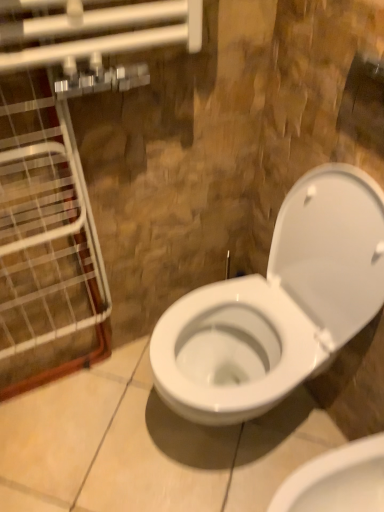
Question: From the image's perspective, is clear glass door at left under white glossy toilet at center, the first toilet ordered from the bottom?

Choices:
 (A) no
 (B) yes

Answer: (A)

Question: Can you confirm if clear glass door at left is thinner than white glossy toilet at center, the first toilet ordered from the bottom?

Choices:
 (A) no
 (B) yes

Answer: (B)

Question: Is the depth of clear glass door at left greater than that of white glossy toilet at center, acting as the second toilet starting from the top?

Choices:
 (A) no
 (B) yes

Answer: (A)

Question: Is clear glass door at left turned away from white glossy toilet at center, the first toilet ordered from the bottom?

Choices:
 (A) no
 (B) yes

Answer: (A)

Question: From the image's perspective, is clear glass door at left above white glossy toilet at center, the first toilet ordered from the bottom?

Choices:
 (A) no
 (B) yes

Answer: (B)

Question: Does clear glass door at left have a larger size compared to white glossy toilet at center, acting as the second toilet starting from the top?

Choices:
 (A) yes
 (B) no

Answer: (A)

Question: Is white glossy toilet at center, the first toilet ordered from the bottom, not inside clear glass door at left?

Choices:
 (A) no
 (B) yes

Answer: (B)

Question: Is white glossy toilet at center, acting as the second toilet starting from the top, thinner than clear glass door at left?

Choices:
 (A) no
 (B) yes

Answer: (A)

Question: Is white glossy toilet at center, the first toilet ordered from the bottom, shorter than clear glass door at left?

Choices:
 (A) yes
 (B) no

Answer: (A)

Question: Is white glossy toilet at center, the first toilet ordered from the bottom, looking in the opposite direction of clear glass door at left?

Choices:
 (A) yes
 (B) no

Answer: (B)

Question: From a real-world perspective, is white glossy toilet at center, acting as the second toilet starting from the top, located higher than clear glass door at left?

Choices:
 (A) no
 (B) yes

Answer: (A)

Question: Can you confirm if white glossy toilet at center, acting as the second toilet starting from the top, is taller than clear glass door at left?

Choices:
 (A) no
 (B) yes

Answer: (A)

Question: Is white glossy toilet at center, the first toilet ordered from the bottom, in front of white glossy toilet at center, which is the first toilet from top to bottom?

Choices:
 (A) yes
 (B) no

Answer: (B)